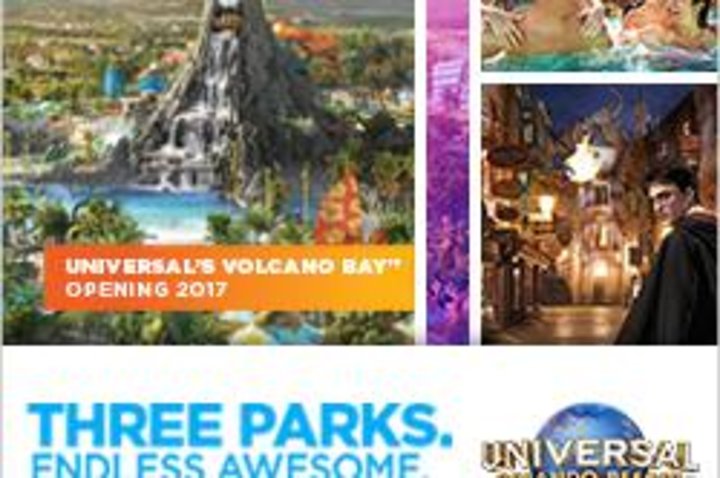
Image resolution: width=720 pixels, height=478 pixels. Identify the location of lights. (603, 269), (546, 202).